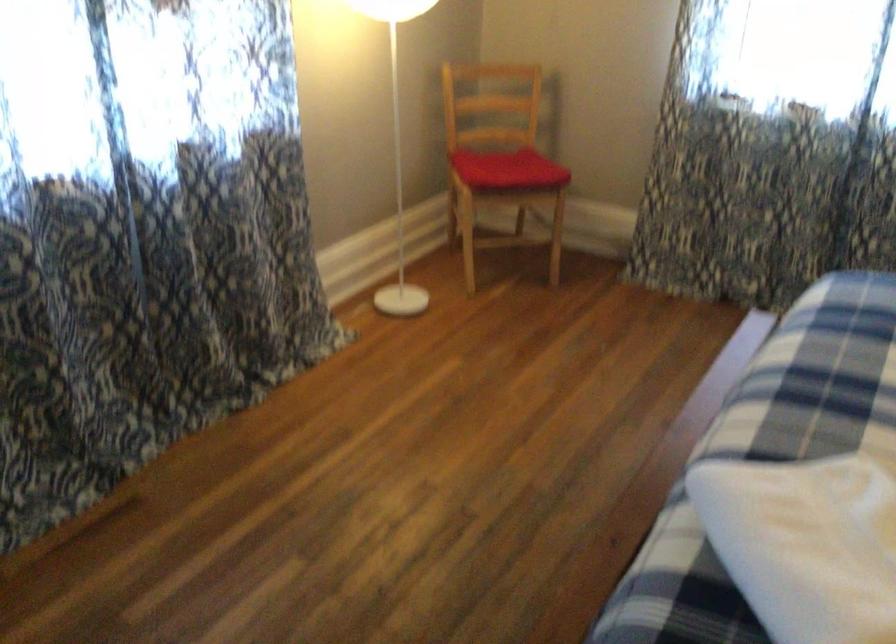
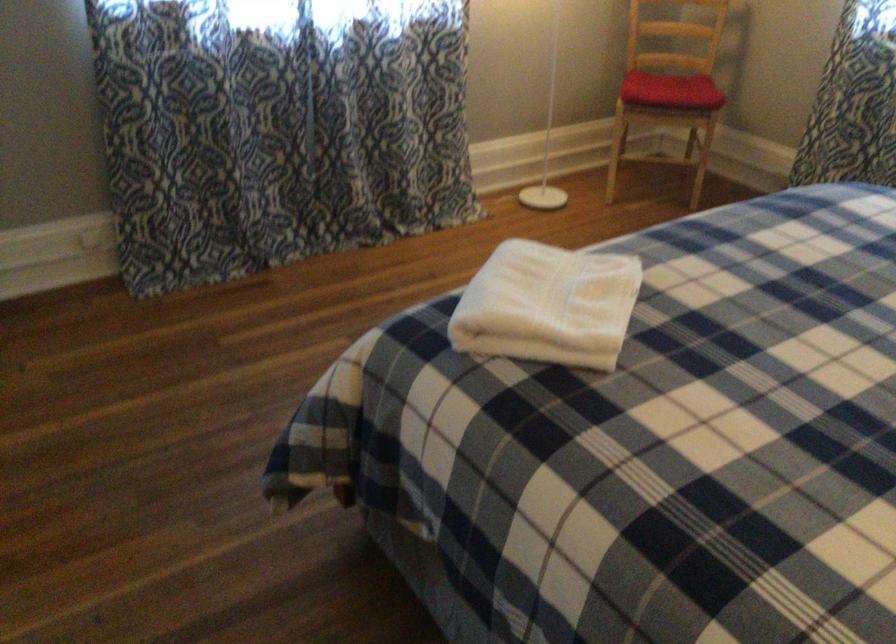
Find the pixel in the second image that matches (x=823, y=565) in the first image.

(547, 305)